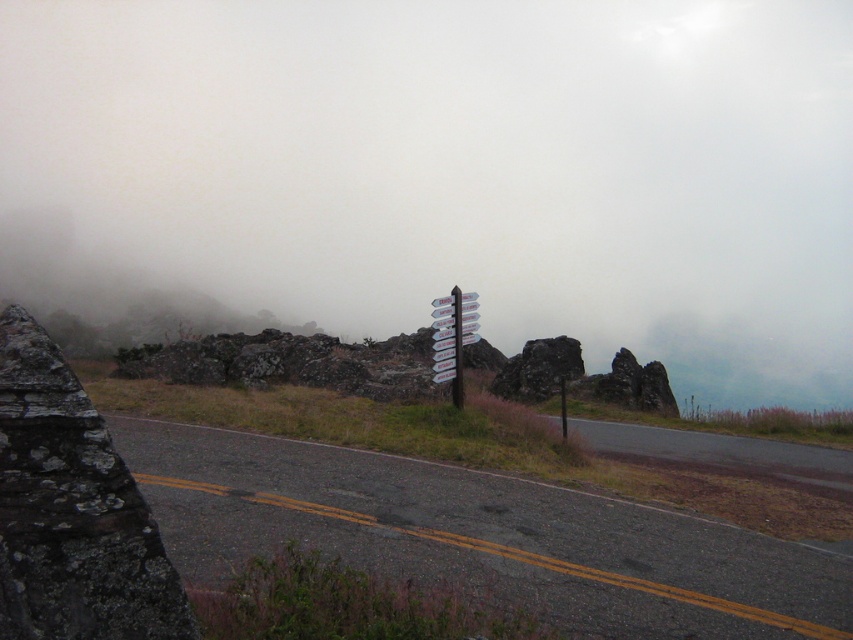
You are a hiker trying to read the signpost while standing on the road. Which object, the white plastic signpost at center or the white plastic pole at center, is closer to your eyes?

The white plastic signpost at center is closer to your eyes because it is positioned below the white plastic pole at center, meaning it is lower and therefore nearer in this scenario.

You are a hiker trying to determine which object is bigger between the white plastic signpost at center and the white plastic pole at center. Based on the scene, which one is larger?

The white plastic signpost at center has a larger size compared to the white plastic pole at center, so the signpost is bigger.